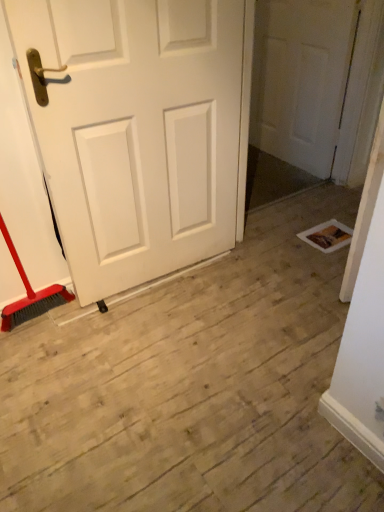
Locate an element on the screen. The image size is (384, 512). free space below white matte door at left, which appears as the 1th door when viewed from the left (from a real-world perspective) is located at coordinates (162, 282).